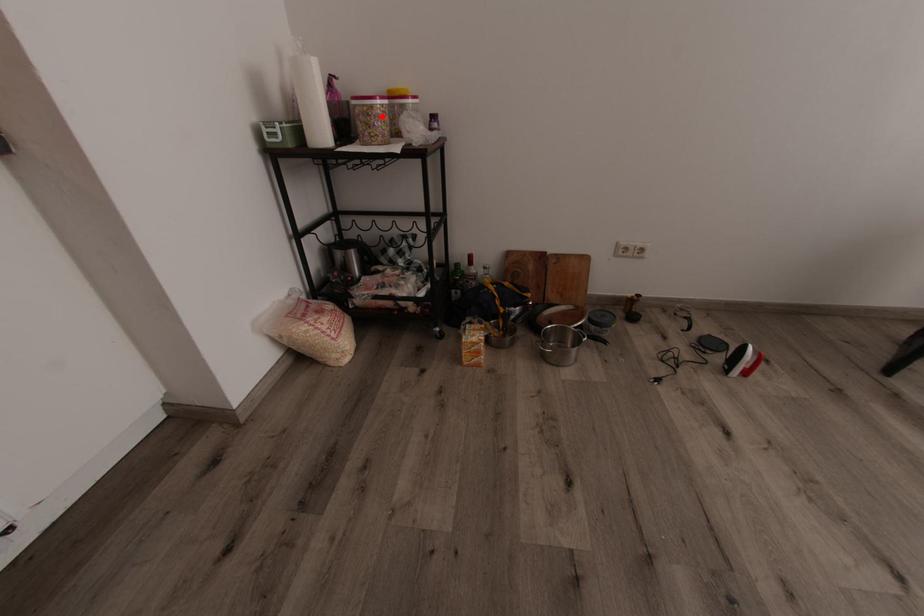
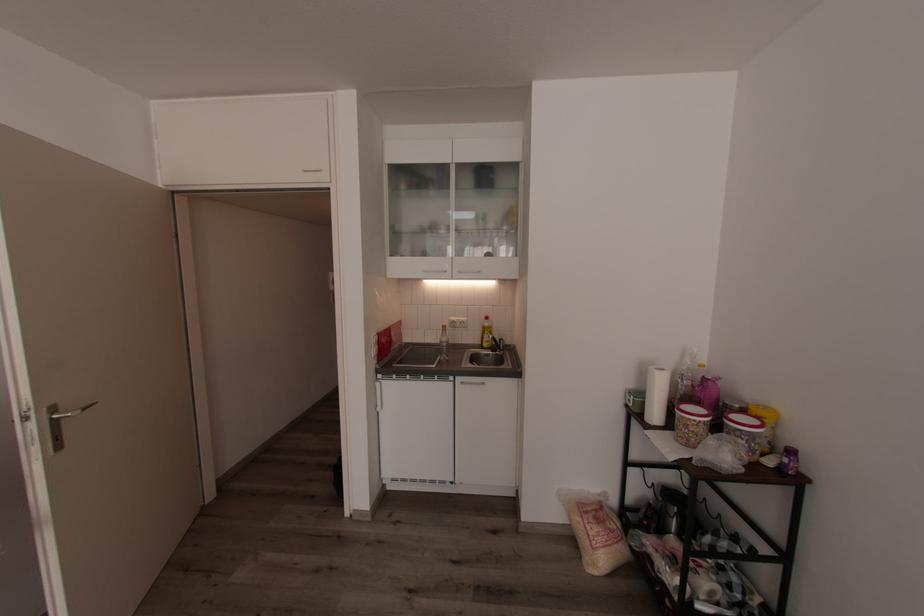
Locate, in the second image, the point that corresponds to the highlighted location in the first image.

(690, 426)